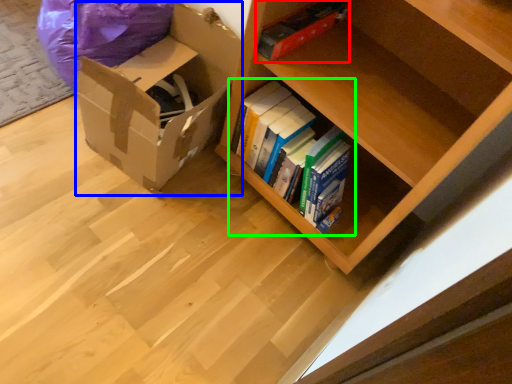
Question: Which object is the closest to the paperback book (highlighted by a red box)? Choose among these: cardboard box (highlighted by a blue box) or book (highlighted by a green box).

Choices:
 (A) cardboard box
 (B) book

Answer: (B)